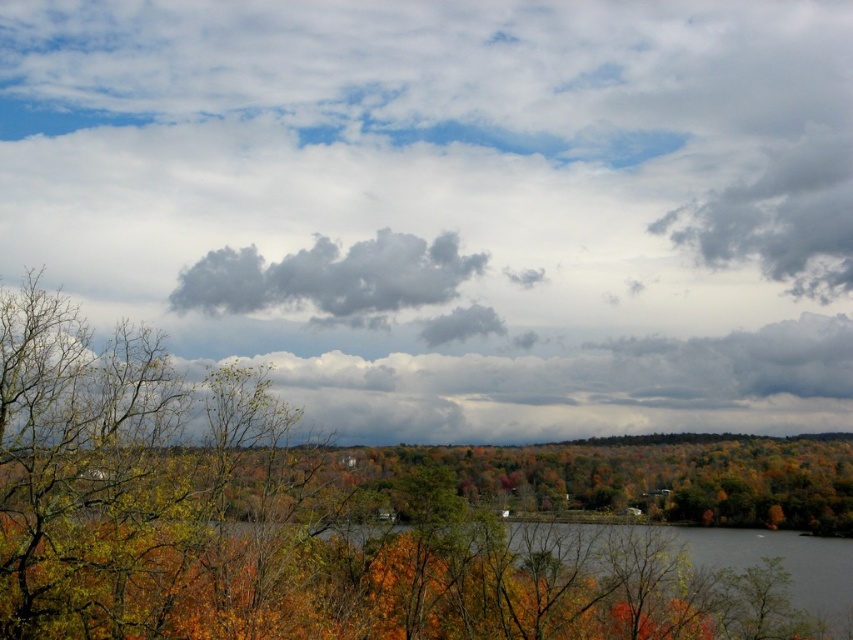
You are a bird soaring in the cloudy sky at upper center. You want to land on the green matte tree at center. Which direction should you fly to reach it?

Since the cloudy sky at upper center is above the green matte tree at center, you should fly downward towards the green matte tree at center to land on it.

You are an airplane pilot preparing to land and you see the cloudy sky at upper center and the dark gray fluffy cloud at center. Which cloud formation is higher in the sky?

The cloudy sky at upper center is located above the dark gray fluffy cloud at center, so the cloudy sky at upper center is higher in the sky.

You are standing at the edge of the forest and notice a green matte tree at center. Based on its position, can you determine if it is closer to the foreground or the middle ground of the scene?

The green matte tree at center is located at point 0.816 on the x and 0.326 on the y axis, which places it closer to the middle ground of the scene.